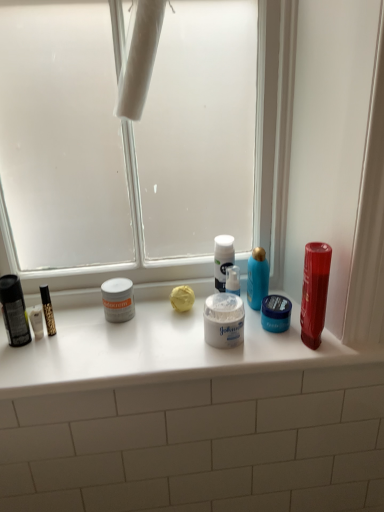
Where is `vacant area that lies in front of transparent glass window screen at center`? vacant area that lies in front of transparent glass window screen at center is located at coordinates (130, 332).